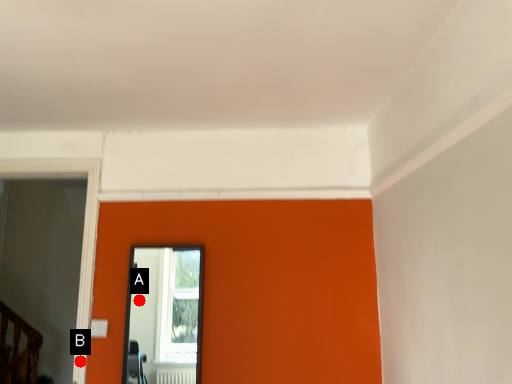
Question: Two points are circled on the image, labeled by A and B beside each circle. Which point appears farthest from the camera in this image?

Choices:
 (A) A is further
 (B) B is further

Answer: (A)